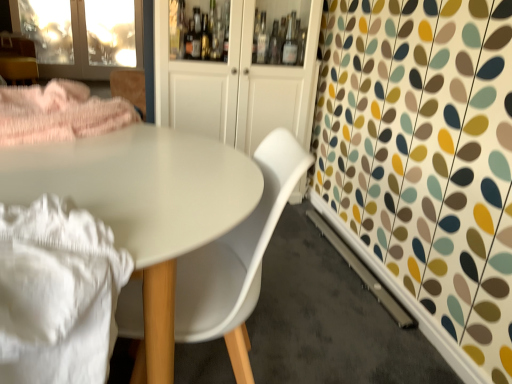
Question: Is white glossy cabinet at center wider than matte white table at center?

Choices:
 (A) yes
 (B) no

Answer: (B)

Question: Is white glossy cabinet at center facing away from matte white table at center?

Choices:
 (A) yes
 (B) no

Answer: (B)

Question: Could you tell me if white glossy cabinet at center is facing matte white table at center?

Choices:
 (A) no
 (B) yes

Answer: (B)

Question: Is matte white table at center located within white glossy cabinet at center?

Choices:
 (A) yes
 (B) no

Answer: (B)

Question: Does white glossy cabinet at center have a smaller size compared to matte white table at center?

Choices:
 (A) no
 (B) yes

Answer: (B)

Question: Considering the relative positions of transparent glass screen door at upper left and matte pink fabric at upper left in the image provided, is transparent glass screen door at upper left to the left or to the right of matte pink fabric at upper left?

Choices:
 (A) right
 (B) left

Answer: (B)

Question: From the image's perspective, is transparent glass screen door at upper left above or below matte pink fabric at upper left?

Choices:
 (A) above
 (B) below

Answer: (A)

Question: Is transparent glass screen door at upper left situated inside matte pink fabric at upper left or outside?

Choices:
 (A) inside
 (B) outside

Answer: (B)

Question: In terms of height, does transparent glass screen door at upper left look taller or shorter compared to matte pink fabric at upper left?

Choices:
 (A) tall
 (B) short

Answer: (A)

Question: Would you say matte pink fabric at upper left is to the left or to the right of transparent glass screen door at upper left in the picture?

Choices:
 (A) right
 (B) left

Answer: (A)

Question: In terms of size, does matte pink fabric at upper left appear bigger or smaller than transparent glass screen door at upper left?

Choices:
 (A) big
 (B) small

Answer: (B)

Question: From a real-world perspective, is matte pink fabric at upper left above or below transparent glass screen door at upper left?

Choices:
 (A) below
 (B) above

Answer: (A)

Question: Is matte pink fabric at upper left in front of or behind transparent glass screen door at upper left in the image?

Choices:
 (A) front
 (B) behind

Answer: (A)

Question: Considering the positions of white glossy cabinet at center and matte pink fabric at upper left in the image, is white glossy cabinet at center wider or thinner than matte pink fabric at upper left?

Choices:
 (A) wide
 (B) thin

Answer: (B)

Question: Is white glossy cabinet at center to the left or to the right of matte pink fabric at upper left in the image?

Choices:
 (A) left
 (B) right

Answer: (B)